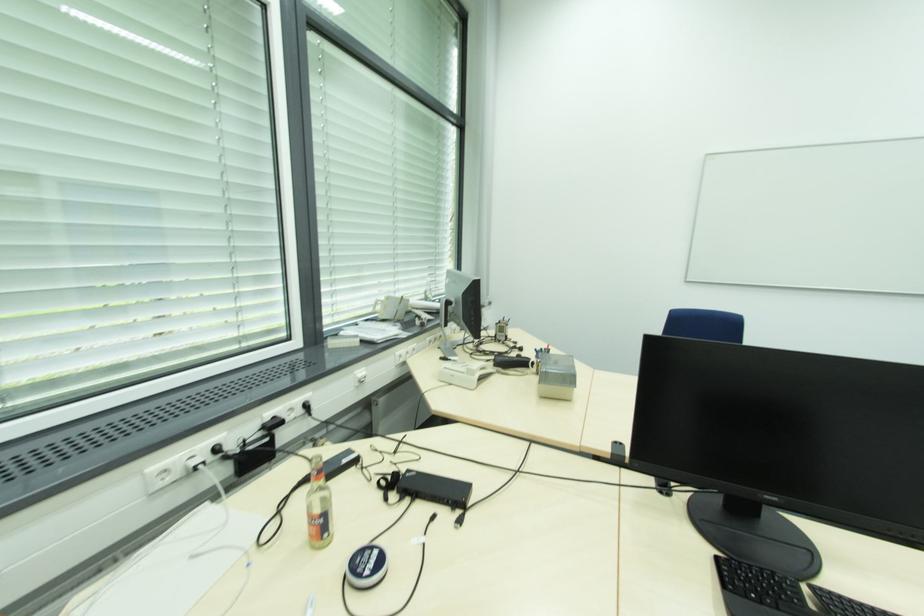
What do you see at coordinates (319, 506) in the screenshot? I see `the glass beer bottle` at bounding box center [319, 506].